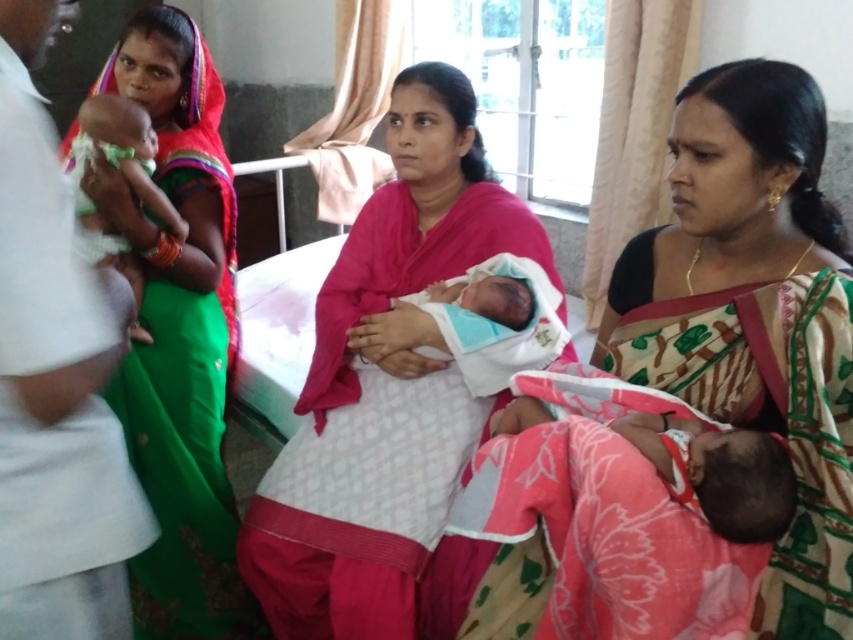
Which is below, printed cotton sari at center or soft pink fabric at lower right?

soft pink fabric at lower right is below.

Who is taller, printed cotton sari at center or soft pink fabric at lower right?

Standing taller between the two is printed cotton sari at center.

Who is more forward, [732,211] or [700,486]?

Point [700,486] is more forward.

Find the location of a particular element. printed cotton sari at center is located at coordinates (691, 397).

Who is positioned more to the right, soft pink fabric at lower right or matte green fabric baby at left?

Positioned to the right is soft pink fabric at lower right.

Locate an element on the screen. The image size is (853, 640). soft pink fabric at lower right is located at coordinates (718, 472).

Who is more distant from viewer, (726, 429) or (131, 282)?

The point (131, 282) is behind.

Where is `soft pink fabric at lower right`? soft pink fabric at lower right is located at coordinates (718, 472).

Describe the element at coordinates (178, 333) in the screenshot. I see `green silk saree at left` at that location.

Is point (171, 120) closer to camera compared to point (393, 356)?

No, (171, 120) is behind (393, 356).

Is point (164, 586) more distant than point (415, 317)?

Yes, point (164, 586) is behind point (415, 317).

What are the coordinates of `green silk saree at left` in the screenshot? It's located at (178, 333).